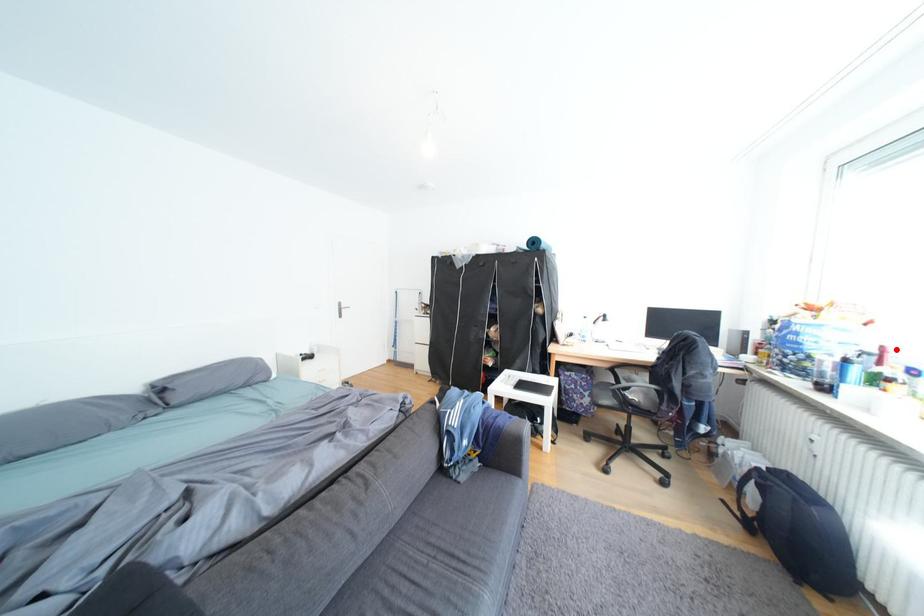
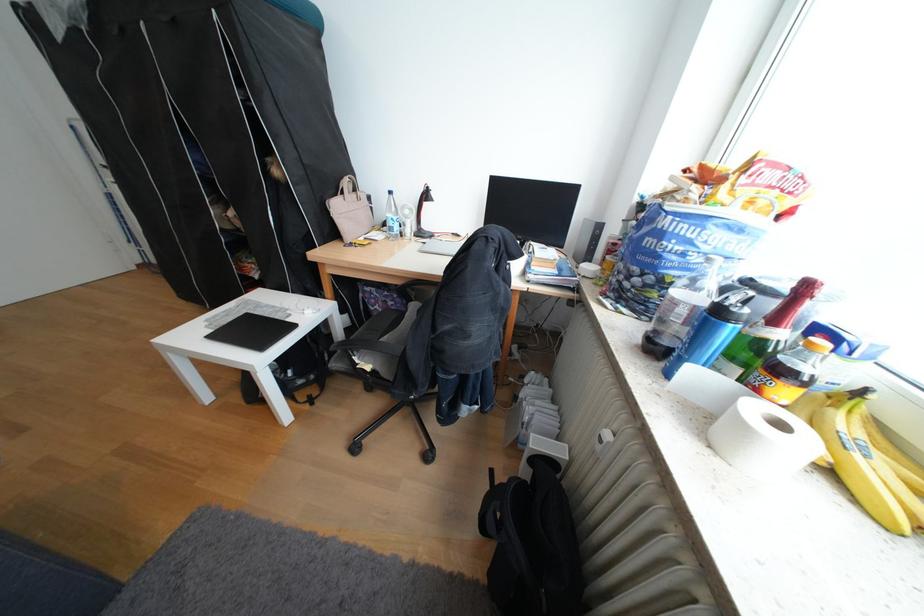
Where in the second image is the point corresponding to the highlighted location from the first image?

(819, 288)